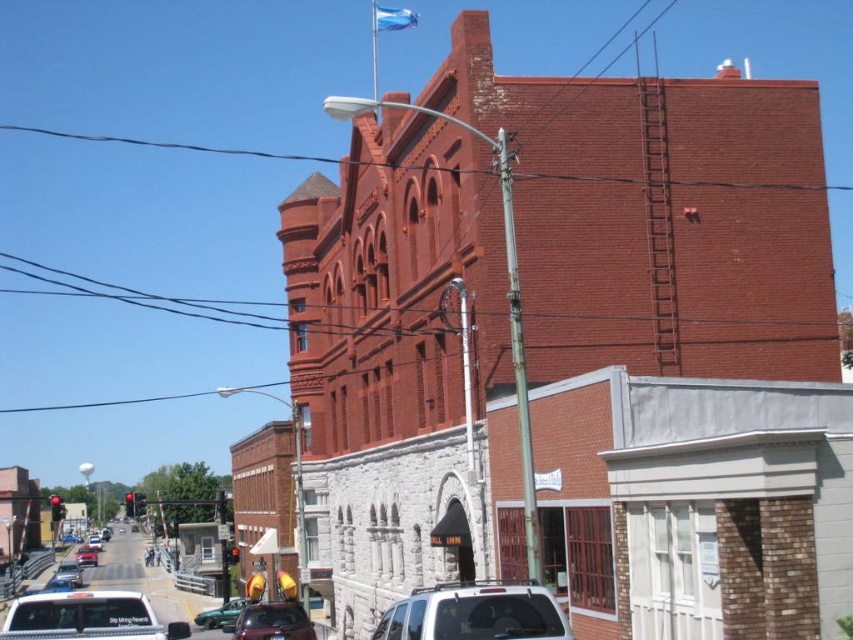
Question: Which object is positioned farthest from the metallic green car at lower left?

Choices:
 (A) metallic silver car at lower left
 (B) metallic silver sedan at lower left
 (C) metallic silver car at lower center
 (D) white matte suv at lower center

Answer: (A)

Question: From the image, what is the correct spatial relationship of white matte van at lower left in relation to metallic silver car at lower center?

Choices:
 (A) left
 (B) right

Answer: (A)

Question: Estimate the real-world distances between objects in this image. Which object is farther from the white matte suv at lower center?

Choices:
 (A) red brick building at center
 (B) metallic silver car at lower left
 (C) metallic silver car at lower center

Answer: (B)

Question: Can you confirm if red brick building at center is smaller than metallic silver car at center?

Choices:
 (A) yes
 (B) no

Answer: (B)

Question: Observing the image, what is the correct spatial positioning of shiny red sedan at lower left in reference to metallic silver sedan at lower left?

Choices:
 (A) left
 (B) right

Answer: (A)

Question: Among these points, which one is nearest to the camera?

Choices:
 (A) (76, 586)
 (B) (9, 618)
 (C) (802, 193)

Answer: (B)